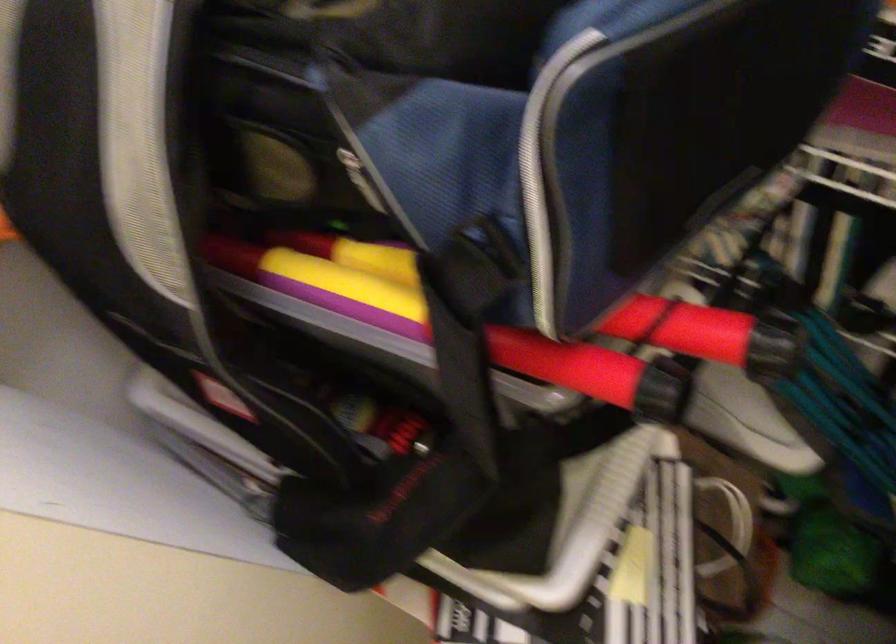
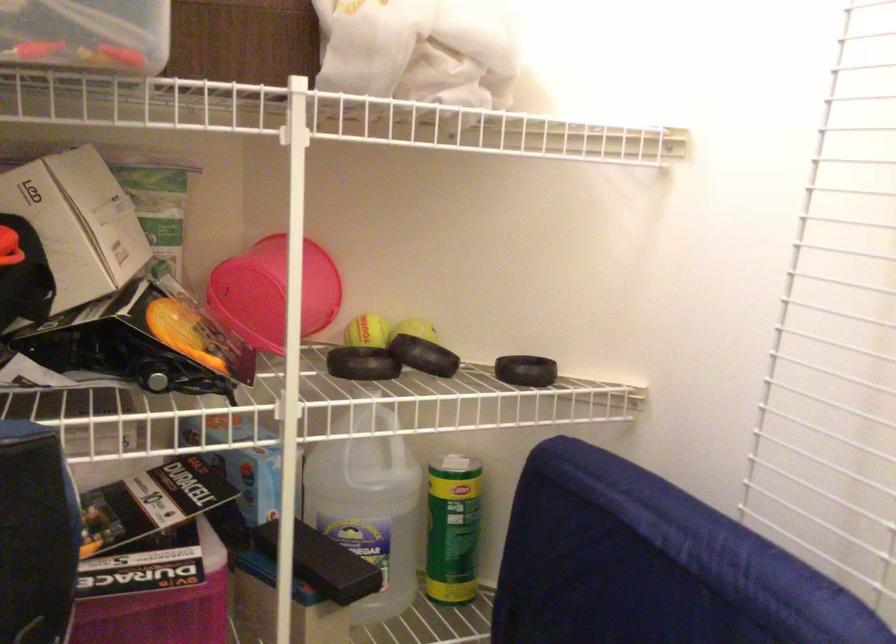
Based on the continuous images, in which direction is the camera rotating?

The rotation direction of the camera is right-up.